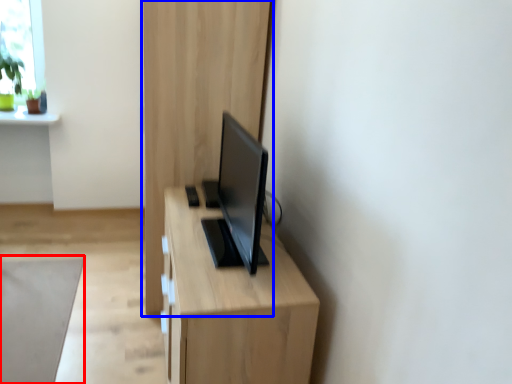
Question: Among these objects, which one is nearest to the camera, plain (highlighted by a red box) or dresser (highlighted by a blue box)?

Choices:
 (A) plain
 (B) dresser

Answer: (A)